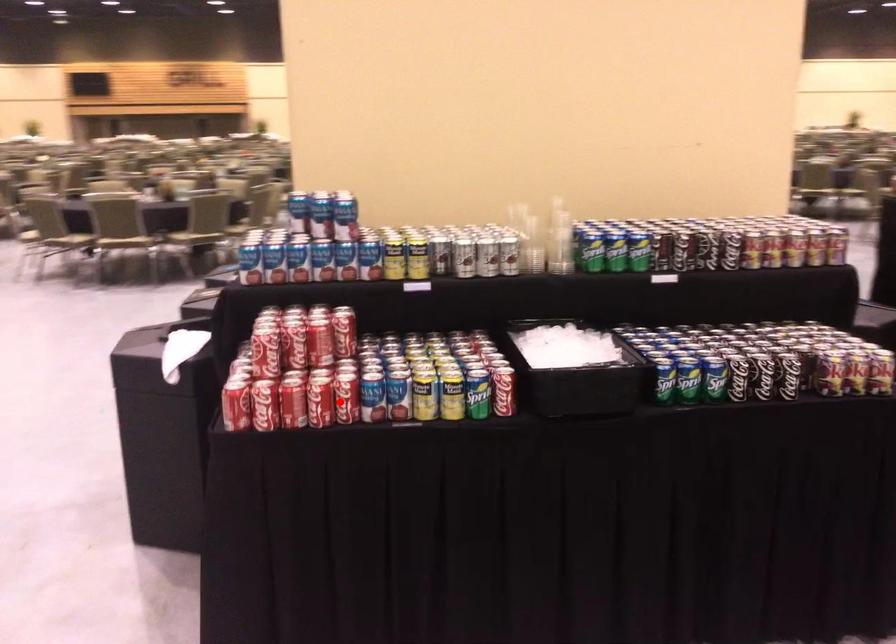
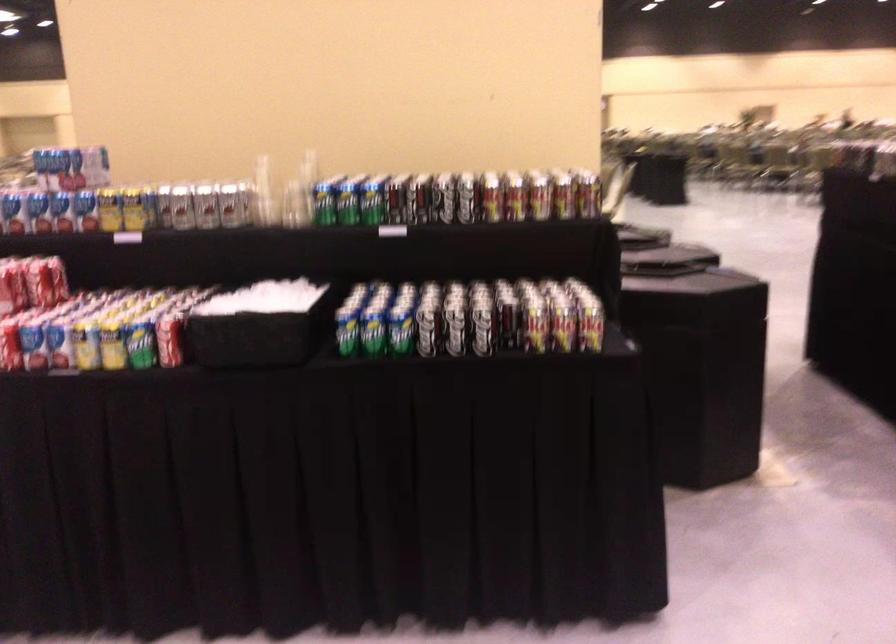
Question: I am providing you with two images of the same scene from different viewpoints. A red point is marked on the first image. Can you still see the location of the red point in image 2?

Choices:
 (A) Yes
 (B) No

Answer: (A)